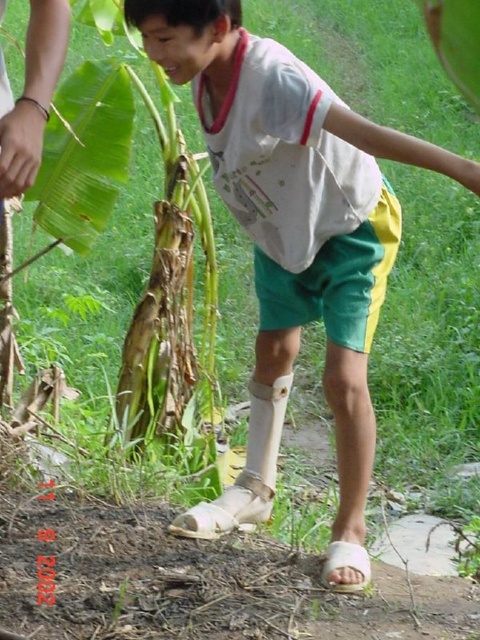
You are a physical therapist evaluating the patient who has a white matte cast at lower center. The patient wants to know if they can bend forward to pick up something near the green matte banana leaf at left without the cast hitting the leaf. Can they?

The white matte cast at lower center is wider than the green matte banana leaf at left. Since the cast is wider, there is a risk that bending forward could cause the cast to come into contact with the leaf, potentially damaging it or causing discomfort. The patient should avoid bending too far to prevent contact.

Consider the image. You are a physical therapist observing a patient who has a white matte cast at lower center. The patient is near a green matte banana leaf at left. According to the scene, which object is located to the right of the other?

The white matte cast at lower center is positioned on the right side of the green matte banana leaf at left.

You are a physical therapist checking on a patient who is recovering from an ankle injury. The patient is standing near a banana plant. You notice the white matte cast at lower center and the green matte banana leaf at left. Which object is taller?

The white matte cast at lower center is taller than the green matte banana leaf at left.